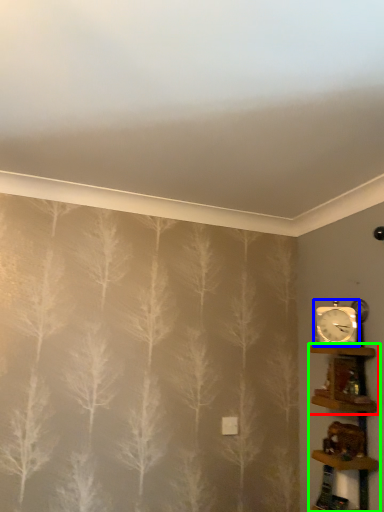
Question: Which object is the closest to the shelf (highlighted by a red box)? Choose among these: clock (highlighted by a blue box) or shelf (highlighted by a green box).

Choices:
 (A) clock
 (B) shelf

Answer: (B)